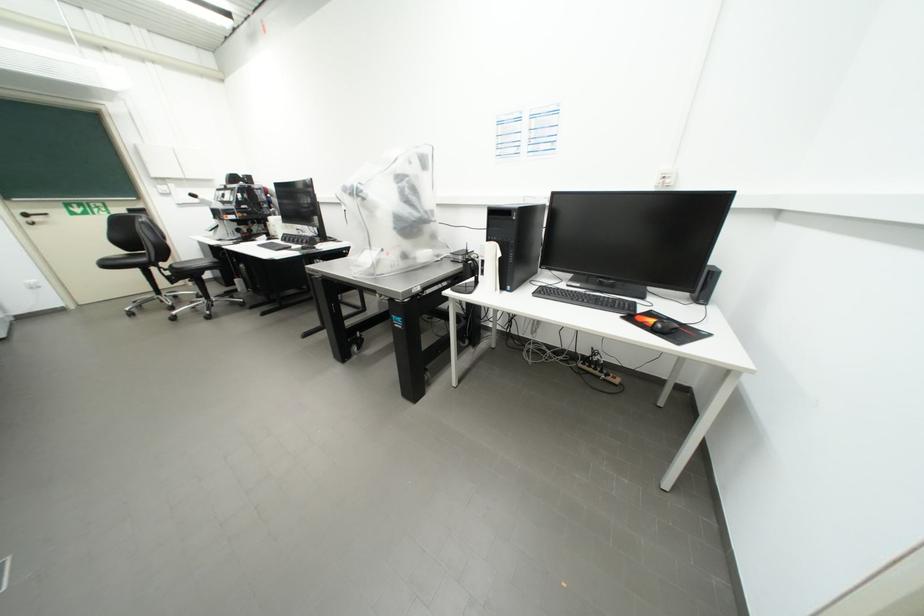
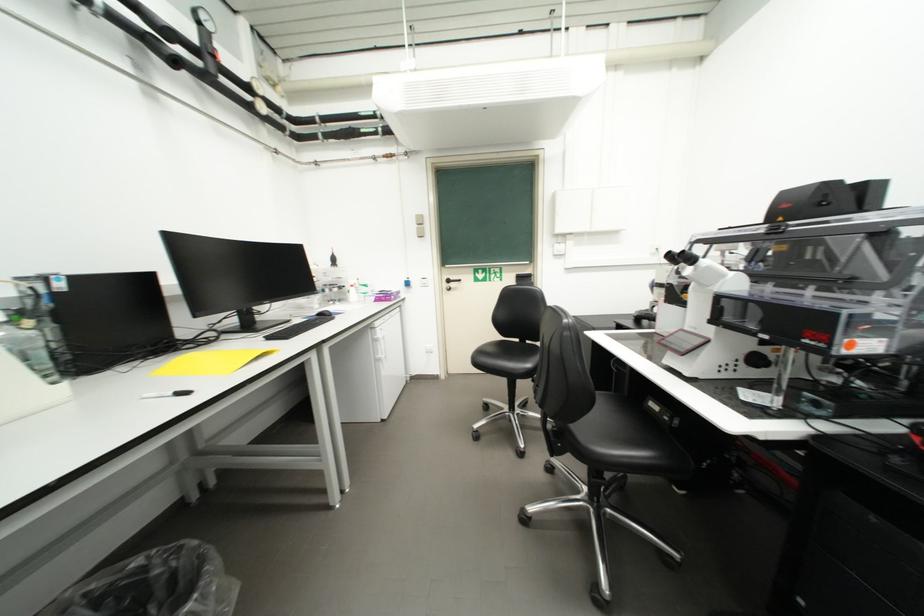
In the second image, find the point that corresponds to (155,188) in the first image.

(553, 249)